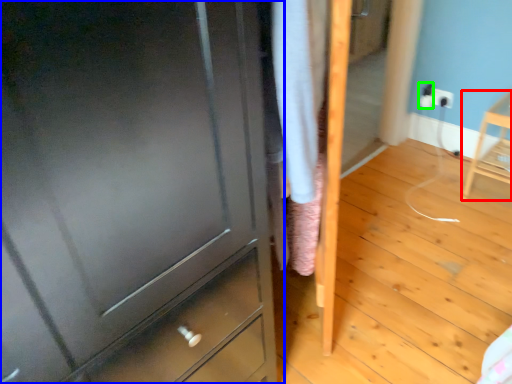
Question: Which object is positioned closest to furniture (highlighted by a red box)? Select from chest of drawers (highlighted by a blue box) and electric outlet (highlighted by a green box).

Choices:
 (A) chest of drawers
 (B) electric outlet

Answer: (B)